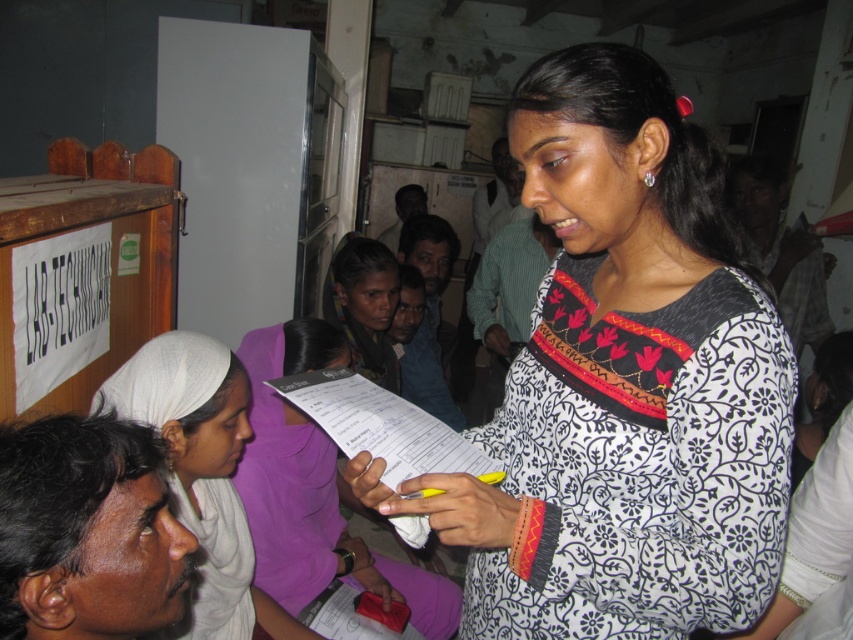
Is white printed dress at center to the left of white fabric headscarf at left from the viewer's perspective?

Incorrect, white printed dress at center is not on the left side of white fabric headscarf at left.

Who is lower down, white printed dress at center or white fabric headscarf at left?

white fabric headscarf at left is lower down.

What do you see at coordinates (624, 385) in the screenshot?
I see `white printed dress at center` at bounding box center [624, 385].

I want to click on white printed dress at center, so click(x=624, y=385).

Which is more to the left, white printed paper at center or dark purple fabric at center?

white printed paper at center

Locate an element on the screen. white printed paper at center is located at coordinates (314, 490).

Can you confirm if white paper at center is bigger than dark purple fabric at center?

Incorrect, white paper at center is not larger than dark purple fabric at center.

Between white paper at center and dark purple fabric at center, which one is positioned higher?

dark purple fabric at center

Does point (395, 484) lie in front of point (397, 273)?

Yes, it is.

Locate an element on the screen. This screenshot has width=853, height=640. white paper at center is located at coordinates (383, 426).